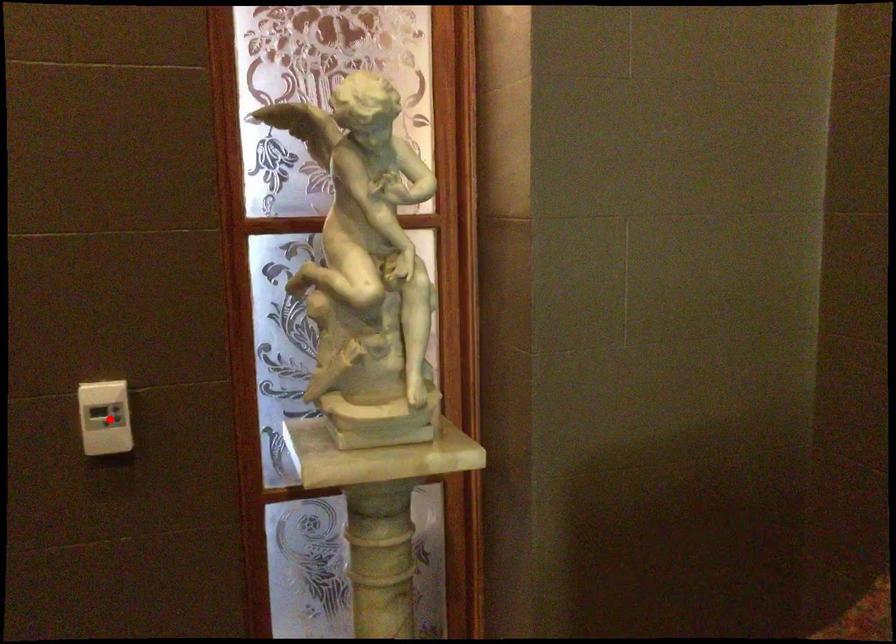
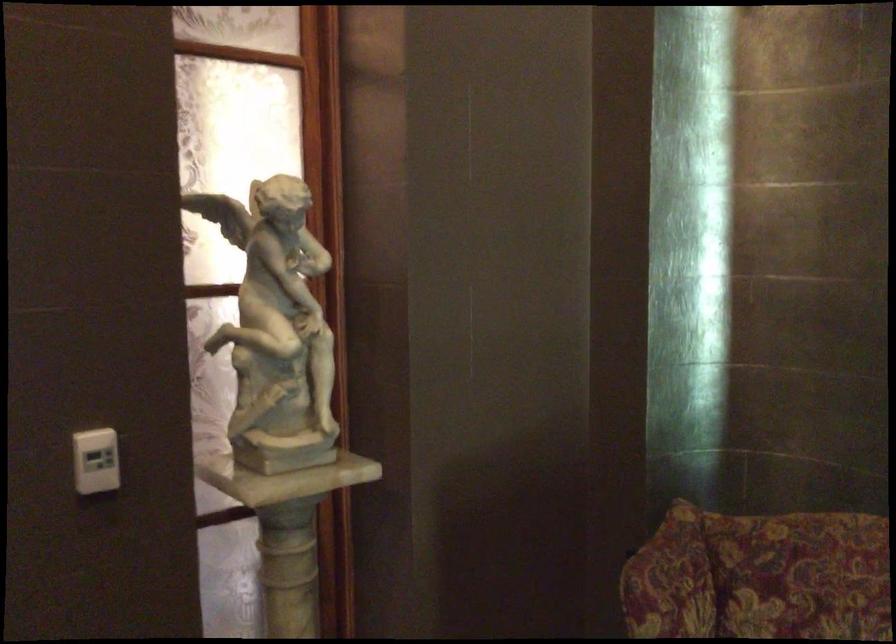
Question: I am providing you with two images of the same scene from different viewpoints. In image1, a red point is highlighted. Considering the same 3D point in image2, which of the following is correct?

Choices:
 (A) It is closer
 (B) It is farther

Answer: (B)